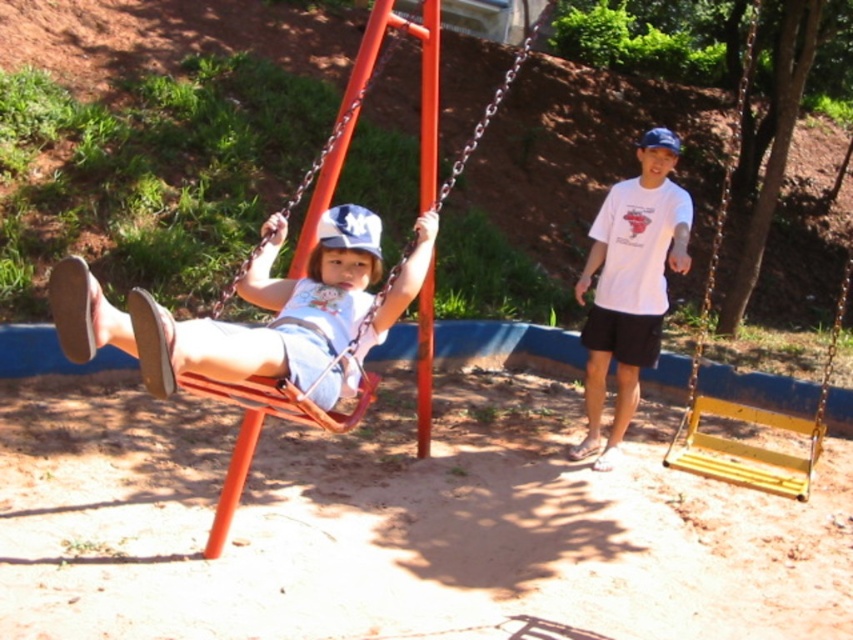
You are a photographer trying to capture a shot of the matte white shorts at center and the matte plastic swing at center. Which object should you focus on first if you want to photograph the shorter one?

The matte white shorts at center is shorter than the matte plastic swing at center, so you should focus on the matte white shorts at center first.

You are standing at the playground and want to know which of the two points, point (x=143, y=307) or point (x=258, y=244), is closer to you. Can you determine this based on the scene?

Point (x=143, y=307) is closer to the viewer than point (x=258, y=244).